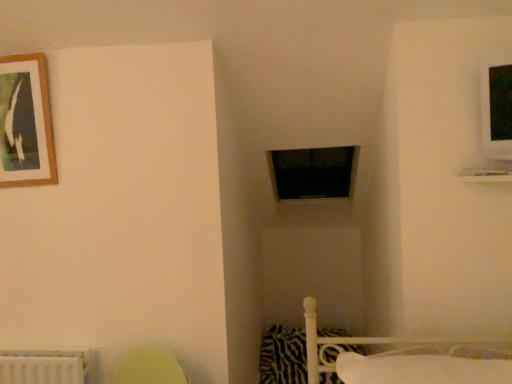
The height and width of the screenshot is (384, 512). Describe the element at coordinates (26, 123) in the screenshot. I see `wooden-framed picture at upper left` at that location.

The image size is (512, 384). What do you see at coordinates (421, 369) in the screenshot? I see `white soft pillow at lower right, which is the 1th pillow from top to bottom` at bounding box center [421, 369].

What do you see at coordinates (314, 183) in the screenshot? I see `black matte window frame at center` at bounding box center [314, 183].

The height and width of the screenshot is (384, 512). I want to click on black matte window frame at center, so click(314, 183).

You are a GUI agent. You are given a task and a screenshot of the screen. Output one action in this format:
    pyautogui.click(x=<x>, y=<y>)
    Task: Click on the wooden-framed picture at upper left
    The image size is (512, 384).
    Given the screenshot: What is the action you would take?
    pyautogui.click(x=26, y=123)

From the image's perspective, between zebra-patterned fabric pillow at lower right, positioned as the 1th pillow in back-to-front order, and black matte window frame at center, who is located below?

zebra-patterned fabric pillow at lower right, positioned as the 1th pillow in back-to-front order, is shown below in the image.

Could you tell me if zebra-patterned fabric pillow at lower right, the 2th pillow viewed from the top, is turned towards black matte window frame at center?

No, zebra-patterned fabric pillow at lower right, the 2th pillow viewed from the top, is not facing towards black matte window frame at center.

This screenshot has height=384, width=512. Find the location of `pillow that is the 2nd one below the wooden-framed picture at upper left (from a real-world perspective)`. pillow that is the 2nd one below the wooden-framed picture at upper left (from a real-world perspective) is located at coordinates (283, 356).

Is zebra-patterned fabric pillow at lower right, positioned as the 1th pillow in back-to-front order, situated inside wooden-framed picture at upper left or outside?

zebra-patterned fabric pillow at lower right, positioned as the 1th pillow in back-to-front order, cannot be found inside wooden-framed picture at upper left.

From the picture: Are zebra-patterned fabric pillow at lower right, positioned as the 1th pillow in back-to-front order, and wooden-framed picture at upper left located far from each other?

zebra-patterned fabric pillow at lower right, positioned as the 1th pillow in back-to-front order, is positioned a significant distance from wooden-framed picture at upper left.

Is black matte window frame at center with white soft pillow at lower right, marked as the first pillow in a front-to-back arrangement?

They are not placed beside each other.

Based on the photo, from a real-world perspective, is black matte window frame at center below white soft pillow at lower right, which is the 1th pillow from top to bottom?

No, from a real-world perspective, black matte window frame at center is not beneath white soft pillow at lower right, which is the 1th pillow from top to bottom.

Looking at this image, which is farther, (341,156) or (473,374)?

Point (341,156)

In the scene shown: Considering the relative sizes of black matte window frame at center and white soft pillow at lower right, which is the 1th pillow from top to bottom, in the image provided, is black matte window frame at center taller than white soft pillow at lower right, which is the 1th pillow from top to bottom,?

Yes, black matte window frame at center is taller than white soft pillow at lower right, which is the 1th pillow from top to bottom.

Consider the image. Is wooden-framed picture at upper left turned away from zebra-patterned fabric pillow at lower right, which is the 2th pillow from front to back?

That's not correct — wooden-framed picture at upper left is not looking away from zebra-patterned fabric pillow at lower right, which is the 2th pillow from front to back.

Is wooden-framed picture at upper left in contact with zebra-patterned fabric pillow at lower right, the 1th pillow from the bottom?

No, wooden-framed picture at upper left is not touching zebra-patterned fabric pillow at lower right, the 1th pillow from the bottom.

This screenshot has width=512, height=384. In order to click on picture frame above the zebra-patterned fabric pillow at lower right, which is the 2th pillow from front to back (from a real-world perspective) in this screenshot , I will do `click(26, 123)`.

Can you confirm if wooden-framed picture at upper left is positioned to the left of zebra-patterned fabric pillow at lower right, positioned as the 1th pillow in back-to-front order?

Yes, wooden-framed picture at upper left is to the left of zebra-patterned fabric pillow at lower right, positioned as the 1th pillow in back-to-front order.

Between wooden-framed picture at upper left and white soft pillow at lower right, which is the 1th pillow from top to bottom, which one has larger size?

white soft pillow at lower right, which is the 1th pillow from top to bottom, is bigger.

Does wooden-framed picture at upper left lie in front of white soft pillow at lower right, which is the second pillow in back-to-front order?

No, the depth of wooden-framed picture at upper left is greater than that of white soft pillow at lower right, which is the second pillow in back-to-front order.

Choose the correct answer: Is wooden-framed picture at upper left inside white soft pillow at lower right, marked as the first pillow in a front-to-back arrangement, or outside it?

wooden-framed picture at upper left is not inside white soft pillow at lower right, marked as the first pillow in a front-to-back arrangement, it's outside.

From their relative heights in the image, would you say wooden-framed picture at upper left is taller or shorter than white soft pillow at lower right, which is the 1th pillow from top to bottom?

Considering their sizes, wooden-framed picture at upper left has more height than white soft pillow at lower right, which is the 1th pillow from top to bottom.

Based on the photo, is white soft pillow at lower right, which is the second pillow in back-to-front order, taller than zebra-patterned fabric pillow at lower right, the 2th pillow viewed from the top?

Incorrect, the height of white soft pillow at lower right, which is the second pillow in back-to-front order, is not larger of that of zebra-patterned fabric pillow at lower right, the 2th pillow viewed from the top.

From a real-world perspective, is white soft pillow at lower right, which is the second pillow in back-to-front order, located higher than zebra-patterned fabric pillow at lower right, positioned as the 1th pillow in back-to-front order?

Yes, from a real-world perspective, white soft pillow at lower right, which is the second pillow in back-to-front order, is above zebra-patterned fabric pillow at lower right, positioned as the 1th pillow in back-to-front order.

Is white soft pillow at lower right, which is the 1th pillow from top to bottom, looking in the opposite direction of zebra-patterned fabric pillow at lower right, which is the 2th pillow from front to back?

No.

Is white soft pillow at lower right, which is the 1th pillow from top to bottom, thinner than zebra-patterned fabric pillow at lower right, the 2th pillow viewed from the top?

No, white soft pillow at lower right, which is the 1th pillow from top to bottom, is not thinner than zebra-patterned fabric pillow at lower right, the 2th pillow viewed from the top.

Between black matte window frame at center and wooden-framed picture at upper left, which one has more height?

Standing taller between the two is wooden-framed picture at upper left.

From the picture: Choose the correct answer: Is black matte window frame at center inside wooden-framed picture at upper left or outside it?

black matte window frame at center lies outside wooden-framed picture at upper left.

From the image's perspective, relative to wooden-framed picture at upper left, is black matte window frame at center above or below?

From the image's perspective, black matte window frame at center appears below wooden-framed picture at upper left.

Considering the positions of point (350, 169) and point (36, 115), is point (350, 169) closer or farther from the camera than point (36, 115)?

Point (350, 169) is positioned farther from the camera compared to point (36, 115).

Where is `window frame in front of the zebra-patterned fabric pillow at lower right, positioned as the 1th pillow in back-to-front order`? window frame in front of the zebra-patterned fabric pillow at lower right, positioned as the 1th pillow in back-to-front order is located at coordinates (314, 183).

What are the coordinates of `the 1st pillow to the right of the wooden-framed picture at upper left, counting from the anchor's position` in the screenshot? It's located at (283, 356).

Considering their positions, is zebra-patterned fabric pillow at lower right, which is the 2th pillow from front to back, positioned closer to wooden-framed picture at upper left than black matte window frame at center?

Among the two, black matte window frame at center is located nearer to wooden-framed picture at upper left.

From the picture: Considering their positions, is zebra-patterned fabric pillow at lower right, the 2th pillow viewed from the top, positioned closer to black matte window frame at center than white soft pillow at lower right, which is the 1th pillow from top to bottom?

The object closer to black matte window frame at center is zebra-patterned fabric pillow at lower right, the 2th pillow viewed from the top.

Looking at the image, which one is located closer to white soft pillow at lower right, which is the second pillow in back-to-front order, zebra-patterned fabric pillow at lower right, the 2th pillow viewed from the top, or wooden-framed picture at upper left?

zebra-patterned fabric pillow at lower right, the 2th pillow viewed from the top.

In the scene shown: When comparing their distances from wooden-framed picture at upper left, does zebra-patterned fabric pillow at lower right, the 1th pillow from the bottom, or white soft pillow at lower right, the 2th pillow positioned from the bottom, seem closer?

Among the two, white soft pillow at lower right, the 2th pillow positioned from the bottom, is located nearer to wooden-framed picture at upper left.

Which object lies further to the anchor point wooden-framed picture at upper left, white soft pillow at lower right, marked as the first pillow in a front-to-back arrangement, or zebra-patterned fabric pillow at lower right, the 2th pillow viewed from the top?

zebra-patterned fabric pillow at lower right, the 2th pillow viewed from the top, lies further to wooden-framed picture at upper left than the other object.

When comparing their distances from white soft pillow at lower right, the 2th pillow positioned from the bottom, does wooden-framed picture at upper left or black matte window frame at center seem closer?

Among the two, wooden-framed picture at upper left is located nearer to white soft pillow at lower right, the 2th pillow positioned from the bottom.

Consider the image. Estimate the real-world distances between objects in this image. Which object is closer to black matte window frame at center, wooden-framed picture at upper left or white soft pillow at lower right, which is the 1th pillow from top to bottom?

white soft pillow at lower right, which is the 1th pillow from top to bottom, is closer to black matte window frame at center.

Based on their spatial positions, is white soft pillow at lower right, the 2th pillow positioned from the bottom, or black matte window frame at center closer to zebra-patterned fabric pillow at lower right, which is the 2th pillow from front to back?

Based on the image, black matte window frame at center appears to be nearer to zebra-patterned fabric pillow at lower right, which is the 2th pillow from front to back.

This screenshot has height=384, width=512. I want to click on pillow between wooden-framed picture at upper left and white soft pillow at lower right, the 2th pillow positioned from the bottom, so click(x=283, y=356).

Identify the location of pillow between wooden-framed picture at upper left and black matte window frame at center from left to right. The height and width of the screenshot is (384, 512). (283, 356).

Find the location of a particular element. The image size is (512, 384). window frame between wooden-framed picture at upper left and white soft pillow at lower right, marked as the first pillow in a front-to-back arrangement is located at coordinates (314, 183).

Find the location of a particular element. window frame between white soft pillow at lower right, the 2th pillow positioned from the bottom, and zebra-patterned fabric pillow at lower right, the 2th pillow viewed from the top, in the front-back direction is located at coordinates (314, 183).